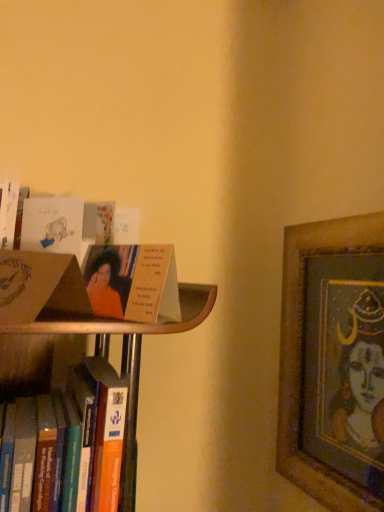
Question: Is matte cardboard book at left, which is the first paperback book from bottom to top, inside matte cardboard book at upper left?

Choices:
 (A) yes
 (B) no

Answer: (B)

Question: Considering the relative sizes of matte cardboard book at upper left and matte cardboard book at left, which is the 1th paperback book in front-to-back order, in the image provided, is matte cardboard book at upper left bigger than matte cardboard book at left, which is the 1th paperback book in front-to-back order,?

Choices:
 (A) no
 (B) yes

Answer: (A)

Question: Considering the relative sizes of matte cardboard book at upper left and matte cardboard book at left, which is the first paperback book from bottom to top, in the image provided, is matte cardboard book at upper left thinner than matte cardboard book at left, which is the first paperback book from bottom to top,?

Choices:
 (A) yes
 (B) no

Answer: (A)

Question: Considering the relative positions of matte cardboard book at upper left and matte cardboard book at left, which is the 1th paperback book in front-to-back order, in the image provided, is matte cardboard book at upper left in front of matte cardboard book at left, which is the 1th paperback book in front-to-back order,?

Choices:
 (A) yes
 (B) no

Answer: (B)

Question: Does matte cardboard book at upper left touch matte cardboard book at left, which is the second paperback book from back to front?

Choices:
 (A) no
 (B) yes

Answer: (B)

Question: Could you tell me if matte cardboard book at upper left is facing matte cardboard book at left, the 2th paperback book from the top?

Choices:
 (A) no
 (B) yes

Answer: (B)

Question: Is wooden framed artwork at right closer to the viewer compared to matte white card at upper left, the first paperback book when ordered from back to front?

Choices:
 (A) no
 (B) yes

Answer: (A)

Question: Is wooden framed artwork at right thinner than matte white card at upper left, the second paperback book in the front-to-back sequence?

Choices:
 (A) yes
 (B) no

Answer: (B)

Question: Is wooden framed artwork at right positioned with its back to matte white card at upper left, the first paperback book in the top-to-bottom sequence?

Choices:
 (A) no
 (B) yes

Answer: (A)

Question: Is wooden framed artwork at right further to the viewer compared to matte white card at upper left, the first paperback book when ordered from back to front?

Choices:
 (A) no
 (B) yes

Answer: (B)

Question: From the image's perspective, does wooden framed artwork at right appear higher than matte white card at upper left, the second paperback book in the front-to-back sequence?

Choices:
 (A) no
 (B) yes

Answer: (A)

Question: From a real-world perspective, is wooden framed artwork at right located higher than matte white card at upper left, the first paperback book when ordered from back to front?

Choices:
 (A) yes
 (B) no

Answer: (B)

Question: From a real-world perspective, does matte white card at upper left, the first paperback book in the top-to-bottom sequence, sit lower than wooden framed artwork at right?

Choices:
 (A) yes
 (B) no

Answer: (B)